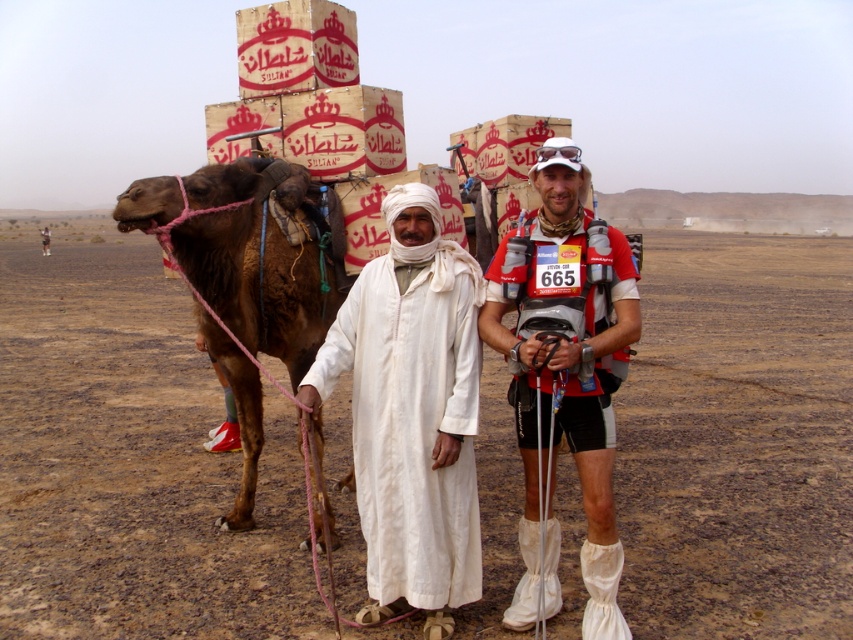
Between white cotton clothing at center and white cotton robe at center, which one appears on the left side from the viewer's perspective?

white cotton robe at center

The image size is (853, 640). What do you see at coordinates (563, 376) in the screenshot?
I see `white cotton clothing at center` at bounding box center [563, 376].

This screenshot has height=640, width=853. I want to click on white cotton clothing at center, so click(x=563, y=376).

Can you confirm if white cotton clothing at center is taller than matte red shirt at center?

Yes, white cotton clothing at center is taller than matte red shirt at center.

Which is behind, point (622, 336) or point (492, 339)?

The point (492, 339) is more distant.

The height and width of the screenshot is (640, 853). Describe the element at coordinates (563, 376) in the screenshot. I see `white cotton clothing at center` at that location.

At what (x,y) coordinates should I click in order to perform the action: click on white cotton clothing at center. Please return your answer as a coordinate pair (x, y). Looking at the image, I should click on (563, 376).

Is white cotton robe at center positioned behind brown rough camel at left?

That is False.

Can you confirm if white cotton robe at center is shorter than brown rough camel at left?

Yes.

What do you see at coordinates (412, 422) in the screenshot?
I see `white cotton robe at center` at bounding box center [412, 422].

Locate an element on the screen. Image resolution: width=853 pixels, height=640 pixels. white cotton robe at center is located at coordinates (412, 422).